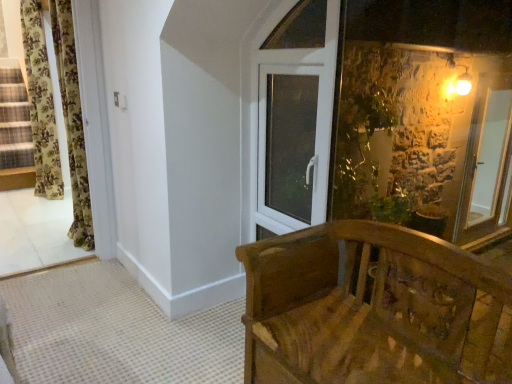
Identify the location of floral fabric curtain at left, which is the first curtain from right to left. (72, 122).

Measure the distance between point (383, 363) and camera.

Point (383, 363) and camera are 1.44 meters apart.

The image size is (512, 384). Describe the element at coordinates (289, 142) in the screenshot. I see `white plastic window at upper center` at that location.

Where is `floral fabric curtain at left, the 1th curtain in the front-to-back sequence`? The width and height of the screenshot is (512, 384). floral fabric curtain at left, the 1th curtain in the front-to-back sequence is located at coordinates (72, 122).

From the image's perspective, is white plastic window at upper center under floral fabric curtain at left, positioned as the 1th curtain in back-to-front order?

Correct, white plastic window at upper center appears lower than floral fabric curtain at left, positioned as the 1th curtain in back-to-front order, in the image.

Could you tell me if white plastic window at upper center is facing floral fabric curtain at left, arranged as the first curtain when viewed from the left?

No, white plastic window at upper center does not turn towards floral fabric curtain at left, arranged as the first curtain when viewed from the left.

Which object is positioned more to the right, white plastic window at upper center or floral fabric curtain at left, which is the second curtain from front to back?

From the viewer's perspective, white plastic window at upper center appears more on the right side.

Find the location of a particular element. This screenshot has width=512, height=384. the 2nd curtain above the white plastic window at upper center (from the image's perspective) is located at coordinates (41, 103).

Is floral fabric curtain at left, marked as the second curtain in a back-to-front arrangement, positioned beyond the bounds of floral fabric curtain at left, positioned as the 1th curtain in back-to-front order?

floral fabric curtain at left, marked as the second curtain in a back-to-front arrangement, lies outside floral fabric curtain at left, positioned as the 1th curtain in back-to-front order,'s area.

Can you confirm if floral fabric curtain at left, which is the first curtain from right to left, is shorter than floral fabric curtain at left, arranged as the first curtain when viewed from the left?

Yes.

Is floral fabric curtain at left, which is the first curtain from right to left, bigger than floral fabric curtain at left, arranged as the first curtain when viewed from the left?

Incorrect, floral fabric curtain at left, which is the first curtain from right to left, is not larger than floral fabric curtain at left, arranged as the first curtain when viewed from the left.

From the picture: What's the angular difference between floral fabric curtain at left, which is the first curtain from right to left, and floral fabric curtain at left, arranged as the first curtain when viewed from the left,'s facing directions?

The angle between the facing direction of floral fabric curtain at left, which is the first curtain from right to left, and the facing direction of floral fabric curtain at left, arranged as the first curtain when viewed from the left, is 0.00378 degrees.

Is floral fabric curtain at left, which is the first curtain from right to left, spatially inside white plastic window at upper center, or outside of it?

floral fabric curtain at left, which is the first curtain from right to left, lies outside white plastic window at upper center.

Is floral fabric curtain at left, marked as the second curtain in a back-to-front arrangement, taller or shorter than white plastic window at upper center?

Clearly, floral fabric curtain at left, marked as the second curtain in a back-to-front arrangement, is taller compared to white plastic window at upper center.

Can you confirm if floral fabric curtain at left, which is the first curtain from right to left, is smaller than white plastic window at upper center?

No.

Could you tell me if floral fabric curtain at left, arranged as the 2th curtain when viewed from the left, is facing wooden carved bench at lower right?

No, floral fabric curtain at left, arranged as the 2th curtain when viewed from the left, does not turn towards wooden carved bench at lower right.

Which point is more forward, (60, 73) or (404, 331)?

The point (404, 331) is in front.

Which of these two, floral fabric curtain at left, the 1th curtain in the front-to-back sequence, or wooden carved bench at lower right, is wider?

Wider between the two is wooden carved bench at lower right.

Is floral fabric curtain at left, arranged as the 2th curtain when viewed from the left, inside the boundaries of wooden carved bench at lower right, or outside?

floral fabric curtain at left, arranged as the 2th curtain when viewed from the left, is located beyond the bounds of wooden carved bench at lower right.

How different are the orientations of wooden carved bench at lower right and floral fabric curtain at left, arranged as the first curtain when viewed from the left, in degrees?

wooden carved bench at lower right and floral fabric curtain at left, arranged as the first curtain when viewed from the left, are facing 4.42 degrees away from each other.

Is wooden carved bench at lower right positioned behind floral fabric curtain at left, arranged as the first curtain when viewed from the left?

That is False.

From the picture: Between wooden carved bench at lower right and floral fabric curtain at left, arranged as the first curtain when viewed from the left, which one has larger width?

wooden carved bench at lower right.

In the scene shown: Is wooden carved bench at lower right not near floral fabric curtain at left, the second curtain viewed from the right?

Indeed, wooden carved bench at lower right is not near floral fabric curtain at left, the second curtain viewed from the right.

Considering the sizes of white plastic window at upper center and floral fabric curtain at left, which is the first curtain from right to left, in the image, is white plastic window at upper center wider or thinner than floral fabric curtain at left, which is the first curtain from right to left,?

white plastic window at upper center is thinner than floral fabric curtain at left, which is the first curtain from right to left.

Is white plastic window at upper center surrounding floral fabric curtain at left, which is the first curtain from right to left?

No, white plastic window at upper center does not contain floral fabric curtain at left, which is the first curtain from right to left.

Would you say white plastic window at upper center is a long distance from floral fabric curtain at left, the 1th curtain in the front-to-back sequence?

Yes, white plastic window at upper center and floral fabric curtain at left, the 1th curtain in the front-to-back sequence, are quite far apart.

From the image's perspective, is white plastic window at upper center above or below floral fabric curtain at left, the 1th curtain in the front-to-back sequence?

white plastic window at upper center is situated lower than floral fabric curtain at left, the 1th curtain in the front-to-back sequence, in the image.

From a real-world perspective, which object stands above the other?

floral fabric curtain at left, the second curtain viewed from the right.

Based on the photo, which of these two, floral fabric curtain at left, which is the second curtain from front to back, or wooden carved bench at lower right, is bigger?

wooden carved bench at lower right is bigger.

Which is nearer, (29, 25) or (259, 257)?

The point (259, 257) is more forward.

Could you tell me if floral fabric curtain at left, positioned as the 1th curtain in back-to-front order, is turned towards wooden carved bench at lower right?

No, floral fabric curtain at left, positioned as the 1th curtain in back-to-front order, does not turn towards wooden carved bench at lower right.

From the white plastic window at upper center, count 2nd curtains backward and point to it. Please provide its 2D coordinates.

[(41, 103)]

Where is `curtain below the floral fabric curtain at left, the second curtain viewed from the right (from a real-world perspective)`? curtain below the floral fabric curtain at left, the second curtain viewed from the right (from a real-world perspective) is located at coordinates (72, 122).

From the picture: Based on their spatial positions, is floral fabric curtain at left, arranged as the 2th curtain when viewed from the left, or white plastic window at upper center closer to floral fabric curtain at left, arranged as the first curtain when viewed from the left?

Among the two, floral fabric curtain at left, arranged as the 2th curtain when viewed from the left, is located nearer to floral fabric curtain at left, arranged as the first curtain when viewed from the left.

Based on their spatial positions, is floral fabric curtain at left, the second curtain viewed from the right, or white plastic window at upper center closer to floral fabric curtain at left, which is the first curtain from right to left?

Based on the image, floral fabric curtain at left, the second curtain viewed from the right, appears to be nearer to floral fabric curtain at left, which is the first curtain from right to left.

Considering their positions, is floral fabric curtain at left, the 1th curtain in the front-to-back sequence, positioned closer to white plastic window at upper center than floral fabric curtain at left, which is the second curtain from front to back?

floral fabric curtain at left, the 1th curtain in the front-to-back sequence, is positioned closer to the anchor white plastic window at upper center.

Looking at the image, which one is located closer to white plastic window at upper center, floral fabric curtain at left, which is the first curtain from right to left, or wooden carved bench at lower right?

Based on the image, wooden carved bench at lower right appears to be nearer to white plastic window at upper center.

Considering their positions, is floral fabric curtain at left, the second curtain viewed from the right, positioned further to floral fabric curtain at left, arranged as the 2th curtain when viewed from the left, than wooden carved bench at lower right?

wooden carved bench at lower right.

Based on their spatial positions, is white plastic window at upper center or floral fabric curtain at left, marked as the second curtain in a back-to-front arrangement, closer to wooden carved bench at lower right?

white plastic window at upper center is closer to wooden carved bench at lower right.

Based on their spatial positions, is wooden carved bench at lower right or white plastic window at upper center further from floral fabric curtain at left, the second curtain viewed from the right?

wooden carved bench at lower right.

Based on their spatial positions, is wooden carved bench at lower right or floral fabric curtain at left, arranged as the 2th curtain when viewed from the left, closer to floral fabric curtain at left, arranged as the first curtain when viewed from the left?

floral fabric curtain at left, arranged as the 2th curtain when viewed from the left, is positioned closer to the anchor floral fabric curtain at left, arranged as the first curtain when viewed from the left.

You are a GUI agent. You are given a task and a screenshot of the screen. Output one action in this format:
    pyautogui.click(x=<x>, y=<y>)
    Task: Click on the curtain between wooden carved bench at lower right and floral fabric curtain at left, which is the second curtain from front to back, from front to back
    The image size is (512, 384).
    Given the screenshot: What is the action you would take?
    pyautogui.click(x=72, y=122)

Find the location of a particular element. curtain between floral fabric curtain at left, positioned as the 1th curtain in back-to-front order, and white plastic window at upper center is located at coordinates (72, 122).

Where is `window between wooden carved bench at lower right and floral fabric curtain at left, arranged as the first curtain when viewed from the left, from front to back`? The image size is (512, 384). window between wooden carved bench at lower right and floral fabric curtain at left, arranged as the first curtain when viewed from the left, from front to back is located at coordinates (289, 142).

Locate an element on the screen. window between floral fabric curtain at left, which is the first curtain from right to left, and wooden carved bench at lower right is located at coordinates (289, 142).